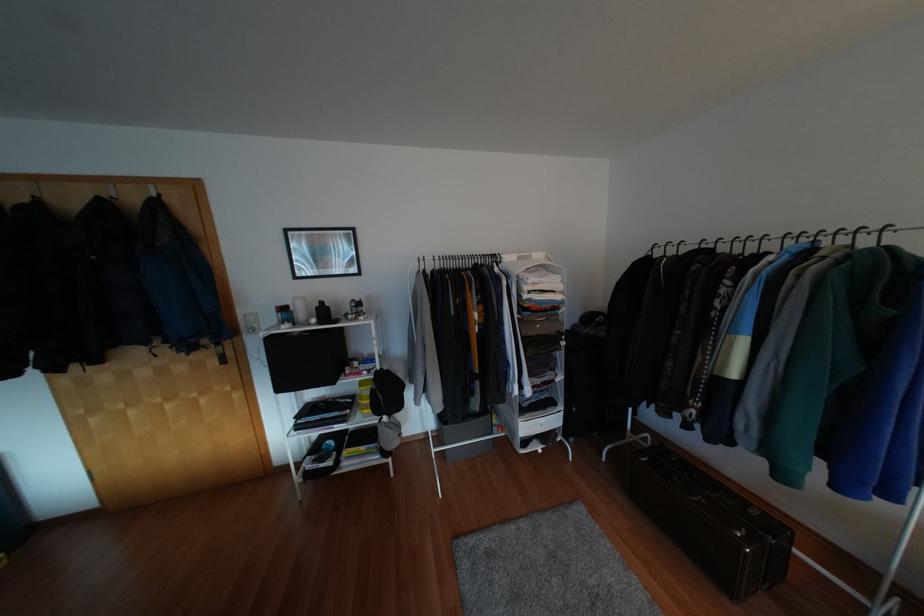
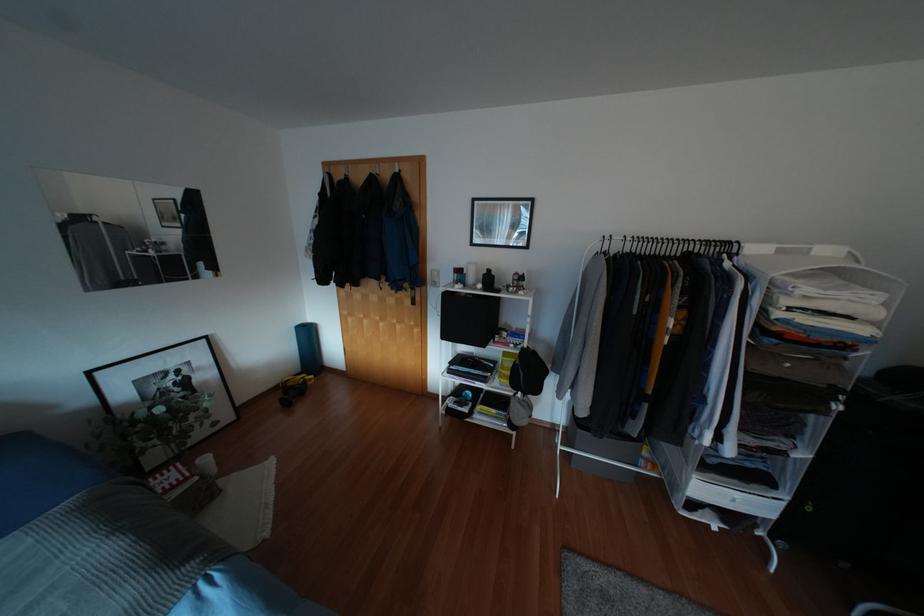
In the second image, find the point that corresponds to point (387, 392) in the first image.

(528, 371)